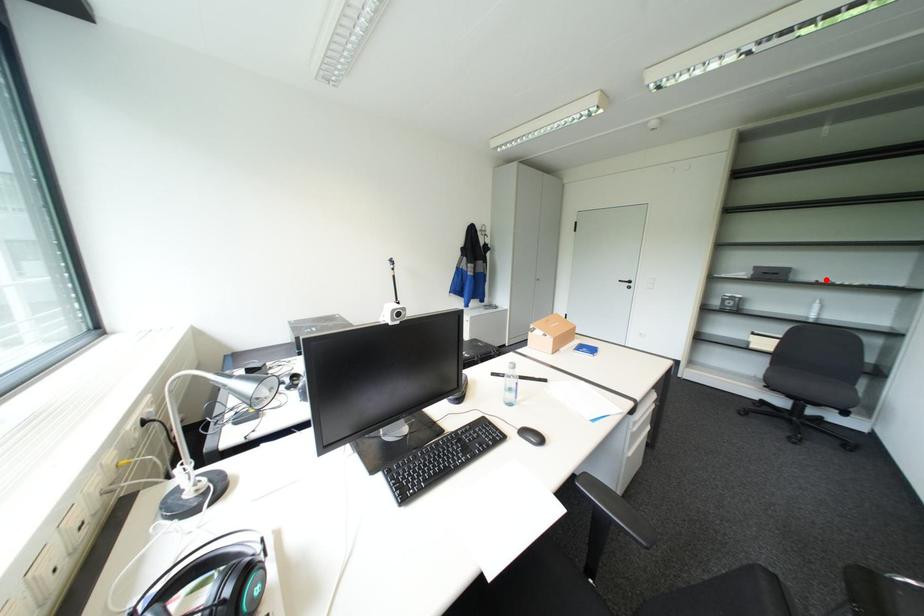
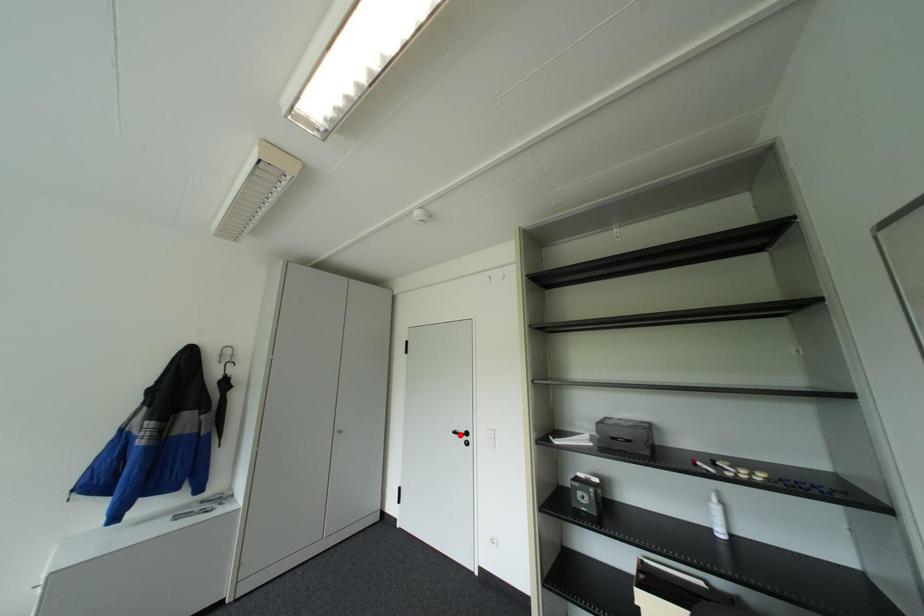
I am providing you with two images of the same scene from different viewpoints. A red point is marked on the first image and another point is marked on the second image. Does the point marked in image1 correspond to the same location as the one in image2?

No